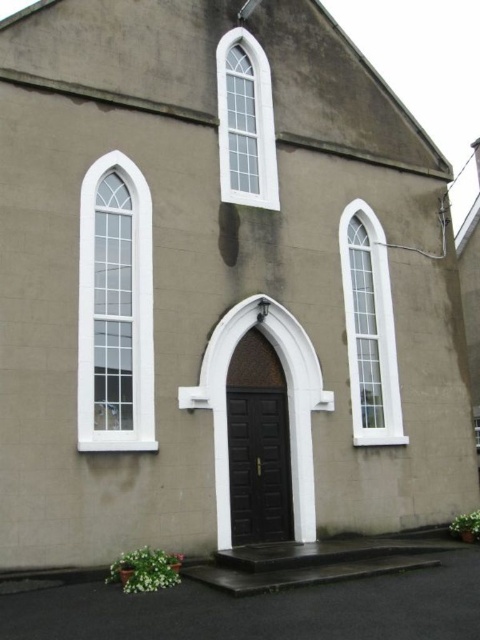
Question: Can you confirm if clear glass window at left is wider than clear glass window at center?

Choices:
 (A) yes
 (B) no

Answer: (B)

Question: Which object is closer to the camera taking this photo?

Choices:
 (A) clear glass window at center
 (B) clear glass window at left

Answer: (B)

Question: Can you confirm if clear glass window at left is positioned to the left of clear glass window at upper center?

Choices:
 (A) no
 (B) yes

Answer: (B)

Question: Among these objects, which one is nearest to the camera?

Choices:
 (A) clear glass window at center
 (B) clear glass window at left
 (C) clear glass window at upper center

Answer: (B)

Question: Which of the following is the farthest from the observer?

Choices:
 (A) (359, 216)
 (B) (132, 296)

Answer: (A)

Question: Is clear glass window at left above clear glass window at center?

Choices:
 (A) no
 (B) yes

Answer: (B)